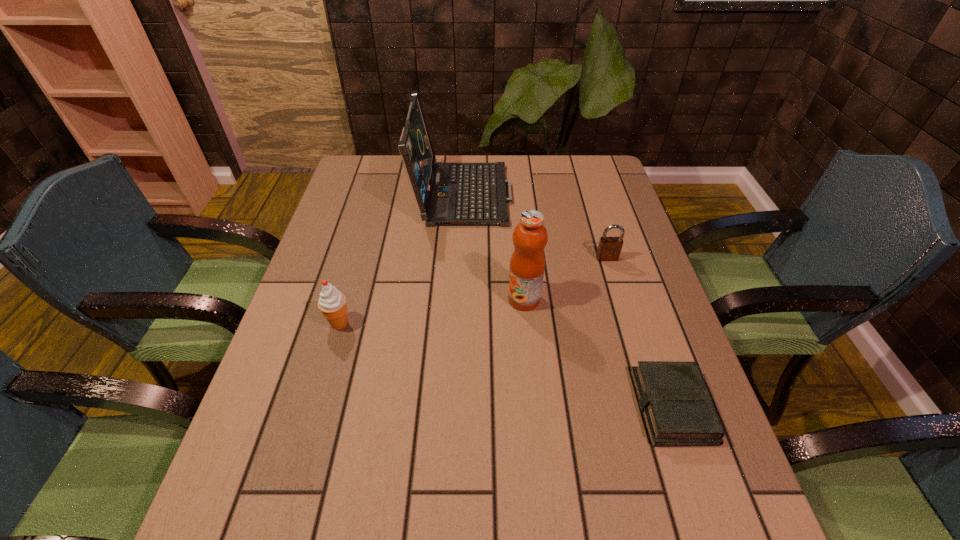
I want to click on vacant space that satisfies the following two spatial constraints: 1. on the front label of the fruit juice; 2. on the front side of the third shortest object, so click(x=526, y=323).

The height and width of the screenshot is (540, 960). In order to click on blank area in the image that satisfies the following two spatial constraints: 1. on the front-facing side of the farthest object; 2. on the front side of the leftmost object in this screenshot , I will do `click(455, 323)`.